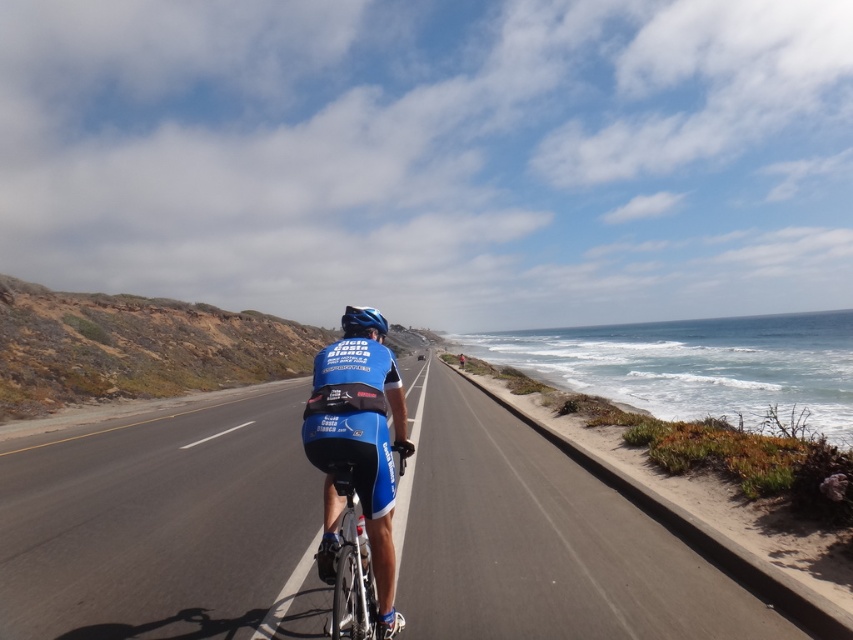
Question: Which point is farther to the camera?

Choices:
 (A) [306, 564]
 (B) [354, 323]
 (C) [735, 541]

Answer: (A)

Question: Does smooth asphalt road at center have a smaller size compared to shiny metallic bicycle at center?

Choices:
 (A) no
 (B) yes

Answer: (A)

Question: Can you confirm if blue fabric jersey at center is positioned below green grassy shoreline at right?

Choices:
 (A) yes
 (B) no

Answer: (B)

Question: Which point is farther to the camera?

Choices:
 (A) (352, 616)
 (B) (384, 326)
 (C) (108, 582)

Answer: (C)

Question: Which object is positioned farthest from the blue matte helmet at center?

Choices:
 (A) green grassy shoreline at right
 (B) blue fabric jersey at center

Answer: (A)

Question: Is smooth asphalt road at center above blue matte helmet at center?

Choices:
 (A) no
 (B) yes

Answer: (A)